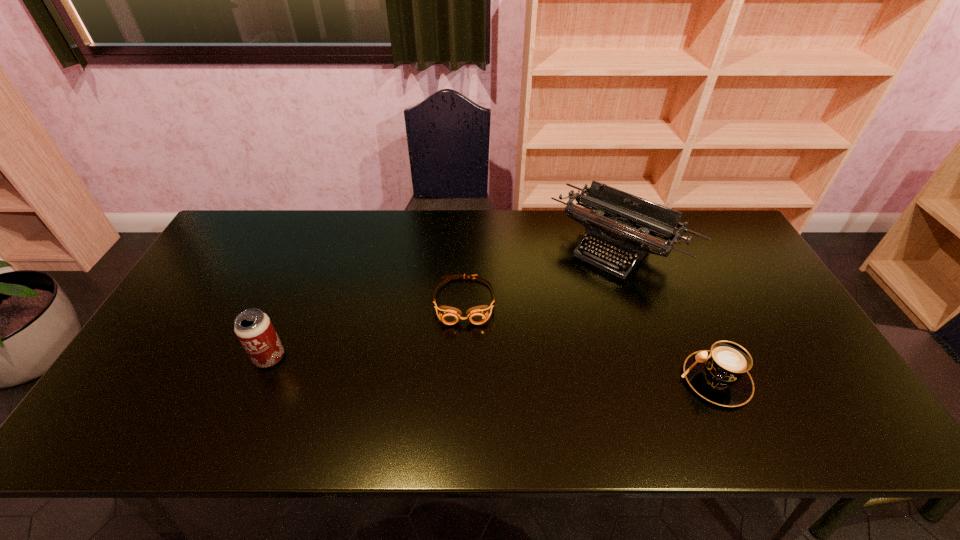
The image size is (960, 540). I want to click on empty space that is in between the cappuccino and the goggles, so click(x=589, y=341).

The image size is (960, 540). Find the location of `the closest object to the typewriter`. the closest object to the typewriter is located at coordinates (477, 315).

Select which object is the third closest to the third tallest object. Please provide its 2D coordinates. Your answer should be formatted as a tuple, i.e. [(x, y)], where the tuple contains the x and y coordinates of a point satisfying the conditions above.

[(254, 329)]

Image resolution: width=960 pixels, height=540 pixels. In order to click on free spot that satisfies the following two spatial constraints: 1. on the front side of the cappuccino; 2. on the right side of the beer can in this screenshot , I will do `click(260, 380)`.

Where is `vacant space that satisfies the following two spatial constraints: 1. on the back side of the beer can; 2. on the left side of the typewriter`? The height and width of the screenshot is (540, 960). vacant space that satisfies the following two spatial constraints: 1. on the back side of the beer can; 2. on the left side of the typewriter is located at coordinates pyautogui.click(x=316, y=247).